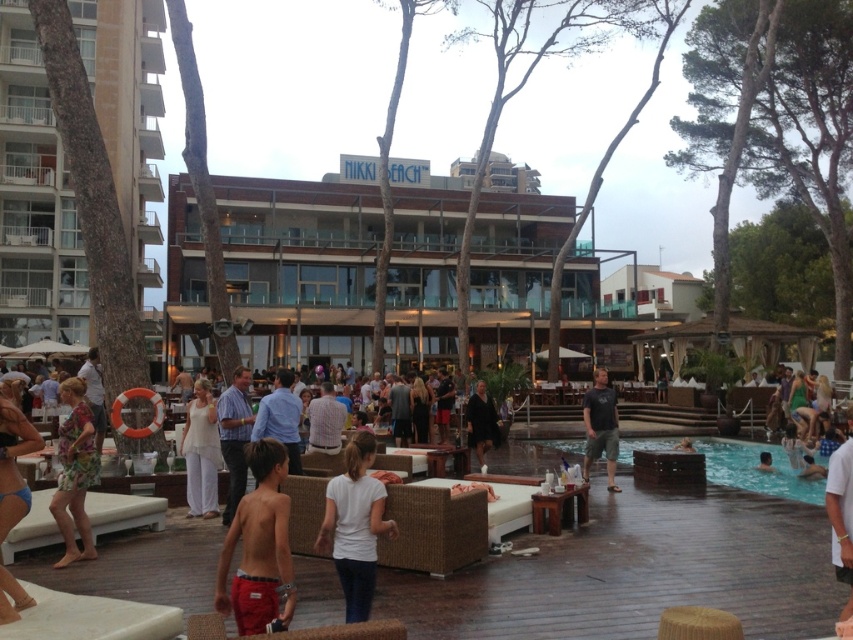
You are a photographer at the beach club. You want to capture a photo of the dark brown leather jacket at center without the floral fabric dress at lower left blocking it. Is the jacket currently visible?

The floral fabric dress at lower left is in front of the dark brown leather jacket at center, so the jacket is currently blocked and not fully visible.

You are a guest at the beach club and want to move from the floral fabric dress at lower left to the dark brown leather jacket at center. Can you walk directly between them without needing to go around any obstacles?

The floral fabric dress at lower left and dark brown leather jacket at center are 7.78 meters apart. Since there are no obstacles mentioned in the scene description, you can walk directly between them without needing to go around anything.

You are standing on the wooden deck at the beach club and see two points marked in the image. Which point, point (x=360, y=544) or point (x=612, y=470), is closer to you?

Point (x=360, y=544) is in front of point (x=612, y=470), so it is closer to you.